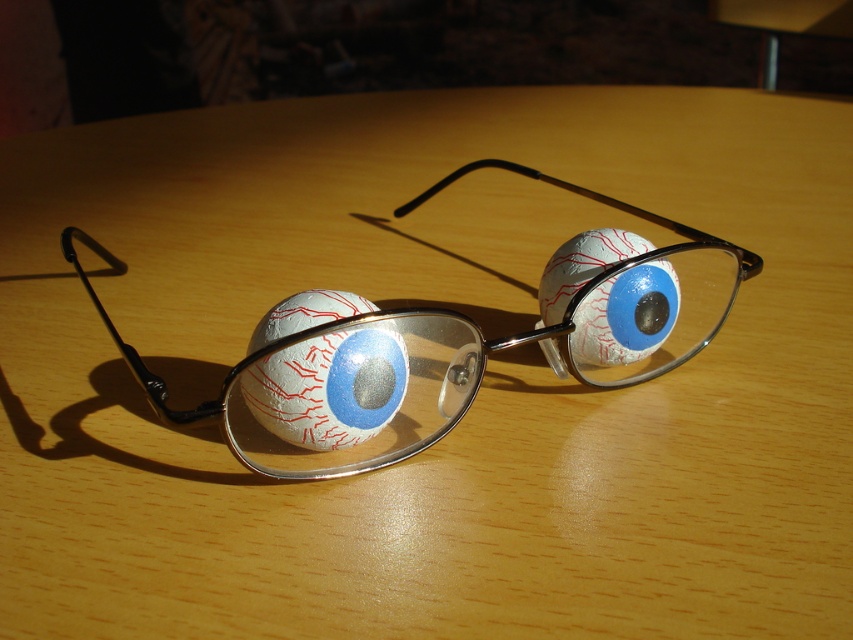
From the picture: You are a photographer adjusting your camera to focus on two points in the image of the glasses. The first point is point (285, 387) and the second is point (611, 232). Which point should you focus on first if you want to capture the closest object in the scene?

Point (285, 387) is closer to the viewer than point (611, 232), so you should focus on point (285, 387) first to capture the closest object in the scene.

You are a photographer setting up a still life scene. You have a white textured baseball at center and a white matte eyeball at center. You want to ensure the baseball appears dominant in the composition. Based on the scene description, which object should you place closer to the camera to achieve this effect?

The white textured baseball at center is already larger in size than the white matte eyeball at center. To make the baseball appear even more dominant, you should place the white textured baseball at center closer to the camera since its larger size combined with proximity will emphasize its prominence in the composition.